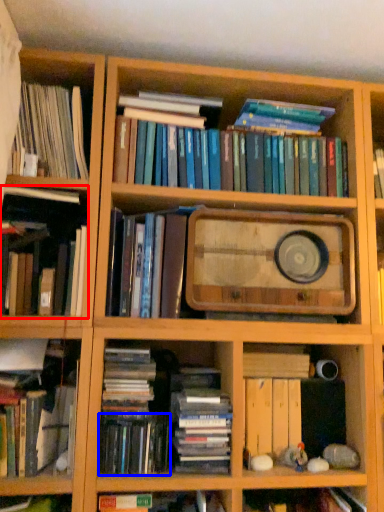
Question: Among these objects, which one is farthest to the camera, book (highlighted by a red box) or book (highlighted by a blue box)?

Choices:
 (A) book
 (B) book

Answer: (B)